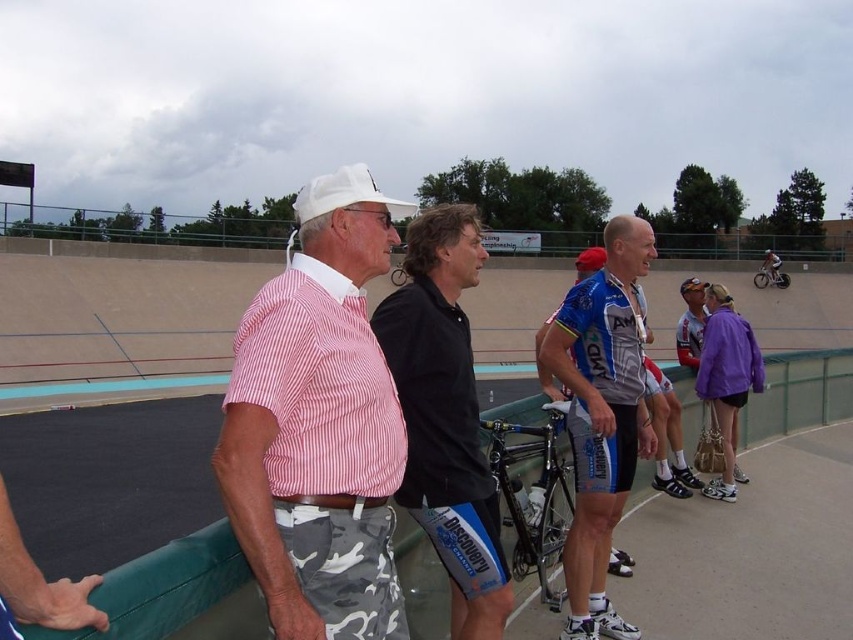
You are a photographer positioned at the edge of the velodrome track. You want to capture a photo of the pink striped shirt at center and the blue jersey at center without any obstructions. Based on their positions, which one should you focus on first to ensure both are in the frame?

The pink striped shirt at center is located above the blue jersey at center, so you should focus on the blue jersey at center first to ensure both are in the frame.

You are a photographer holding a camera. You want to take a photo of the pink striped shirt at center without moving the shirt. Can you step back to ensure you have enough space between you and the shirt to focus properly?

The distance between the pink striped shirt at center and the camera is 1.64 meters. Most cameras can focus at this distance, so stepping back slightly might be possible, but ensure the camera remains within its focusing range. Check your camera manual for minimum focus distance requirements.

In the scene shown: You are a photographer positioned at the edge of the velodrome track. You need to capture a photo of the black jersey at center and blue jersey at center. According to the scene, which jersey is positioned higher in the frame?

The black jersey at center is above the blue jersey at center in the frame.